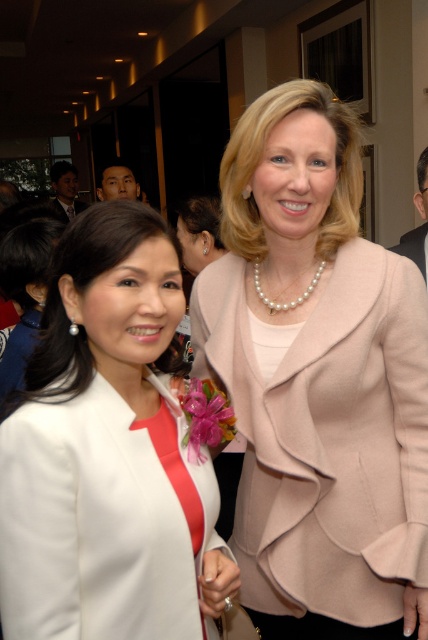
Question: In this image, where is pearl necklace at upper center located relative to matte black suit at left?

Choices:
 (A) left
 (B) right

Answer: (B)

Question: Observing the image, what is the correct spatial positioning of white satin blazer at center in reference to matte black face at upper left?

Choices:
 (A) left
 (B) right

Answer: (B)

Question: Does satin black hair at upper left have a smaller size compared to matte black suit at left?

Choices:
 (A) yes
 (B) no

Answer: (A)

Question: Which of these objects is positioned farthest from the satin black hair at upper left?

Choices:
 (A) black fabric business suit at upper left
 (B) matte black face at upper left
 (C) white satin blazer at center
 (D) matte black suit at left

Answer: (A)

Question: Which object is farther from the camera taking this photo?

Choices:
 (A) black fabric business suit at upper left
 (B) matte black face at upper left

Answer: (A)

Question: Which object appears closest to the camera in this image?

Choices:
 (A) matte black suit at left
 (B) matte black face at upper left

Answer: (B)